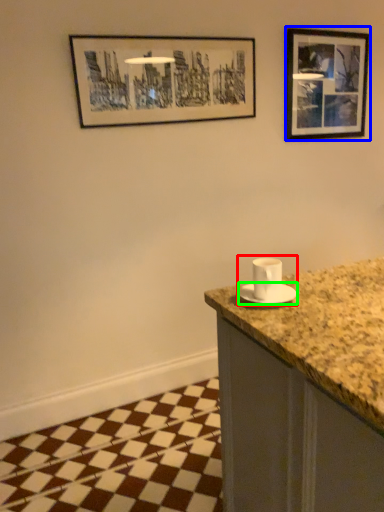
Question: Considering the real-world distances, which object is farthest from sink (highlighted by a red box)? picture frame (highlighted by a blue box) or saucer (highlighted by a green box)?

Choices:
 (A) picture frame
 (B) saucer

Answer: (A)